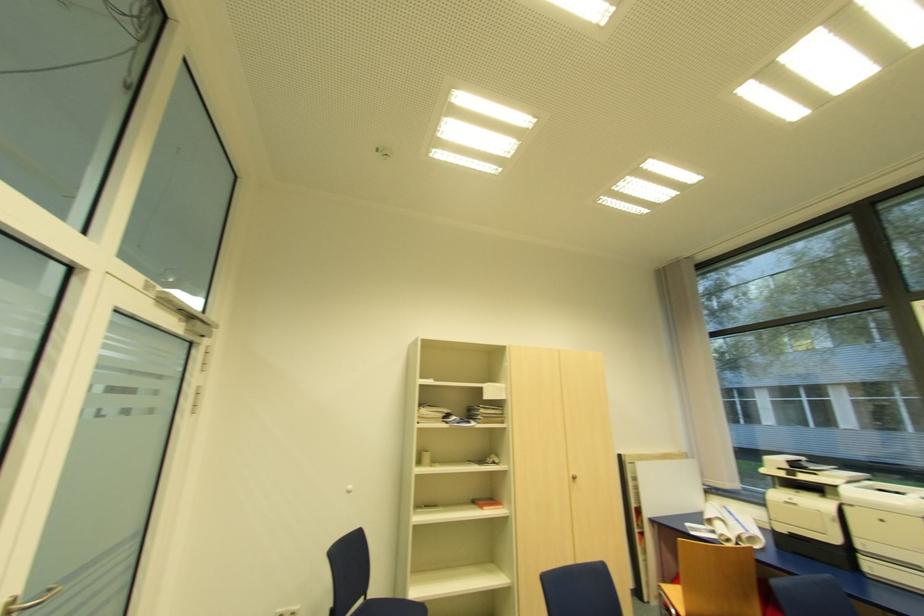
At what (x,y) coordinates should I click in order to perform the action: click on blue chair sitting surface. Please return your answer as a coordinate pair (x, y). This screenshot has width=924, height=616. Looking at the image, I should click on (378, 607).